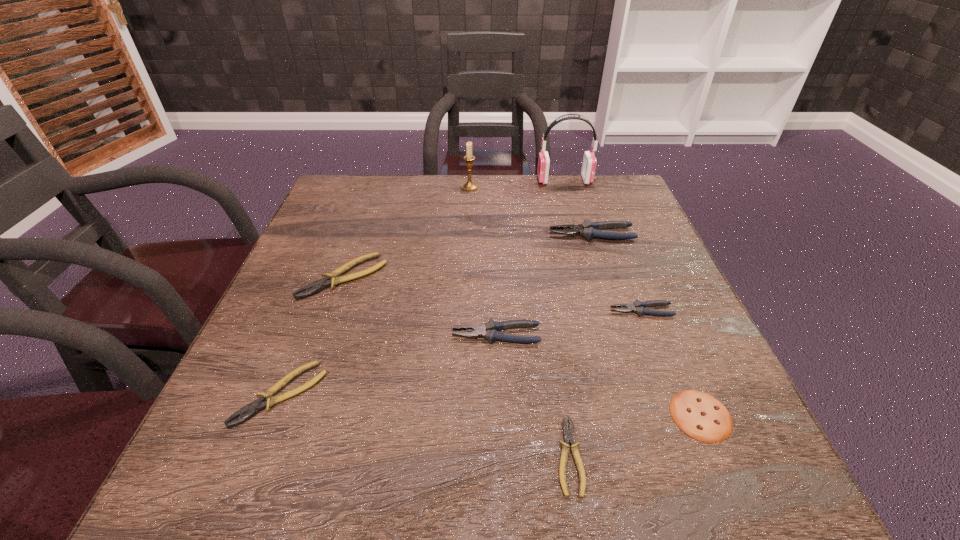
Locate an element on the screen. This screenshot has width=960, height=540. free space between the third farthest object and the cookie is located at coordinates (646, 325).

In order to click on empty space that is in between the rightmost yellow pliers and the second farthest gray pliers in this screenshot , I will do pyautogui.click(x=605, y=383).

This screenshot has height=540, width=960. I want to click on empty space that is in between the fifth tallest pliers and the farthest pliers, so click(x=436, y=314).

I want to click on vacant area that lies between the shortest object and the fourth tallest object, so click(x=533, y=395).

This screenshot has width=960, height=540. I want to click on free space between the shortest pliers and the second farthest pliers, so click(x=456, y=366).

Image resolution: width=960 pixels, height=540 pixels. Find the location of `vacant space in between the eighth shortest object and the cookie`. vacant space in between the eighth shortest object and the cookie is located at coordinates (586, 301).

Locate an element on the screen. This screenshot has width=960, height=540. object that is the second closest to the cookie is located at coordinates (638, 307).

Find the location of a particular element. The height and width of the screenshot is (540, 960). the third closest object to the second shortest pliers is located at coordinates (568, 435).

Where is `pliers that can be found as the closest to the fifth nearest object`? pliers that can be found as the closest to the fifth nearest object is located at coordinates (489, 331).

The height and width of the screenshot is (540, 960). What are the coordinates of `pliers that can be found as the fifth closest to the candle holder` in the screenshot? It's located at (248, 411).